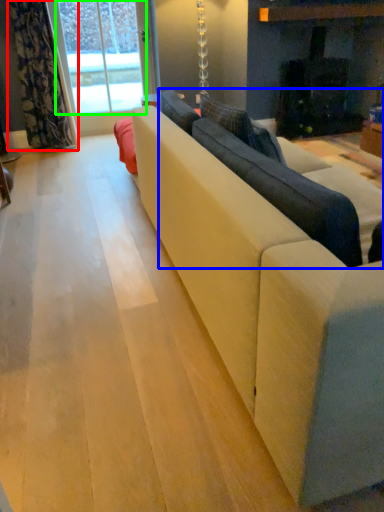
Question: Considering the real-world distances, which object is farthest from curtain (highlighted by a red box)? couch (highlighted by a blue box) or window screen (highlighted by a green box)?

Choices:
 (A) couch
 (B) window screen

Answer: (A)